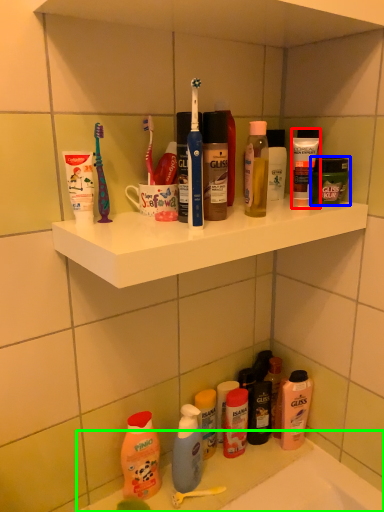
Question: Considering the real-world distances, which object is closest to toiletry (highlighted by a red box)? toiletry (highlighted by a blue box) or counter (highlighted by a green box).

Choices:
 (A) toiletry
 (B) counter

Answer: (A)